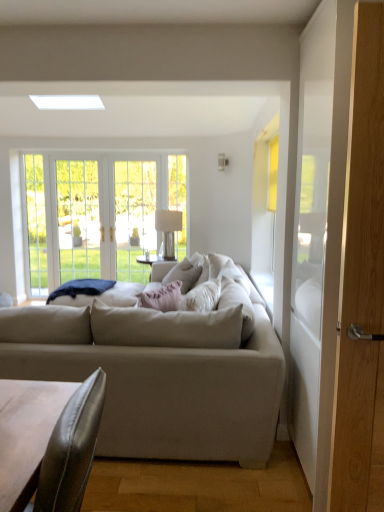
Question: From the image's perspective, would you say clear glass door at left is positioned over clear glass door at center?

Choices:
 (A) no
 (B) yes

Answer: (A)

Question: Considering the relative sizes of clear glass door at left and clear glass door at center in the image provided, is clear glass door at left bigger than clear glass door at center?

Choices:
 (A) no
 (B) yes

Answer: (A)

Question: Can you confirm if clear glass door at left is positioned to the left of clear glass door at center?

Choices:
 (A) no
 (B) yes

Answer: (B)

Question: Considering the relative sizes of clear glass door at left and clear glass door at center in the image provided, is clear glass door at left smaller than clear glass door at center?

Choices:
 (A) yes
 (B) no

Answer: (A)

Question: From a real-world perspective, does clear glass door at left sit lower than clear glass door at center?

Choices:
 (A) yes
 (B) no

Answer: (A)

Question: Are clear glass door at left and clear glass door at center making contact?

Choices:
 (A) no
 (B) yes

Answer: (A)

Question: Can you confirm if pink fabric pillow at center is bigger than clear glass screen door at center, positioned as the 2th screen door in right-to-left order?

Choices:
 (A) no
 (B) yes

Answer: (A)

Question: Is pink fabric pillow at center oriented away from clear glass screen door at center, positioned as the 2th screen door in right-to-left order?

Choices:
 (A) yes
 (B) no

Answer: (B)

Question: Is pink fabric pillow at center next to clear glass screen door at center, the 1th screen door positioned from the back?

Choices:
 (A) yes
 (B) no

Answer: (B)

Question: Could you tell me if pink fabric pillow at center is turned towards clear glass screen door at center, which is the first screen door in left-to-right order?

Choices:
 (A) no
 (B) yes

Answer: (A)

Question: Is pink fabric pillow at center outside of clear glass screen door at center, which is the first screen door in left-to-right order?

Choices:
 (A) yes
 (B) no

Answer: (A)

Question: Can you confirm if pink fabric pillow at center is positioned to the left of clear glass screen door at center, the 1th screen door positioned from the back?

Choices:
 (A) no
 (B) yes

Answer: (A)

Question: From a real-world perspective, is wooden screen door at right, acting as the 2th screen door starting from the back, physically below clear glass door at center?

Choices:
 (A) no
 (B) yes

Answer: (A)